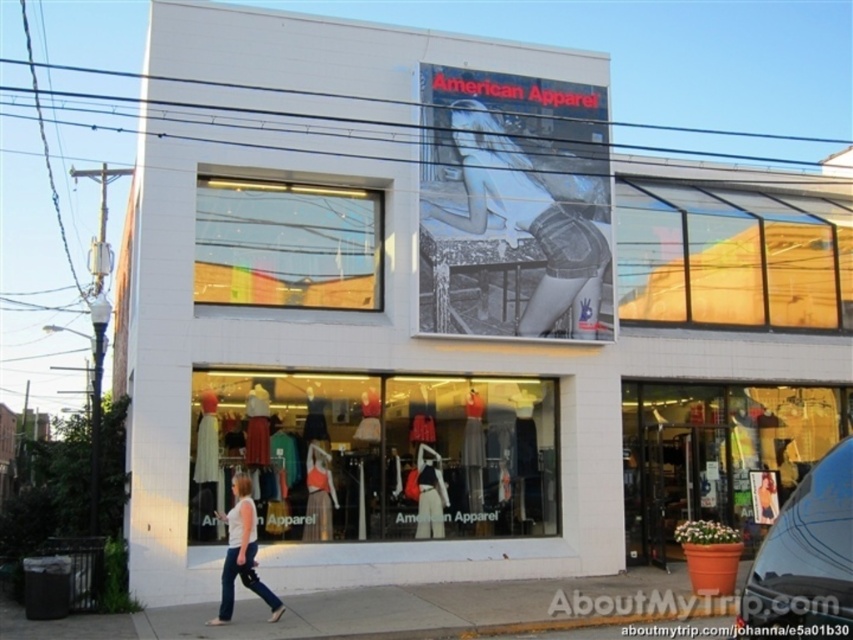
Who is positioned more to the left, smooth concrete sidewalk at lower center or denim shorts at upper center?

smooth concrete sidewalk at lower center

Between point (616, 582) and point (549, 285), which one is positioned behind?

The point (549, 285) is behind.

Is point (20, 618) closer to camera compared to point (476, 124)?

Yes, it is in front of point (476, 124).

Image resolution: width=853 pixels, height=640 pixels. In order to click on smooth concrete sidewalk at lower center in this screenshot , I will do `click(363, 611)`.

Who is positioned more to the right, transparent glass at center or white cotton shirt at lower center?

transparent glass at center

Is point (335, 212) positioned before point (254, 520)?

No.

Measure the distance between transparent glass at center and camera.

transparent glass at center is 12.09 meters from camera.

The width and height of the screenshot is (853, 640). I want to click on transparent glass at center, so click(287, 244).

Is transparent glass at center further to the viewer compared to matte black dress at center?

No, transparent glass at center is closer to the viewer.

Is transparent glass at center to the right of matte black dress at center from the viewer's perspective?

Incorrect, transparent glass at center is not on the right side of matte black dress at center.

Between point (241, 262) and point (418, 476), which one is positioned in front?

Point (241, 262)

Where is `transparent glass at center`? The image size is (853, 640). transparent glass at center is located at coordinates (287, 244).